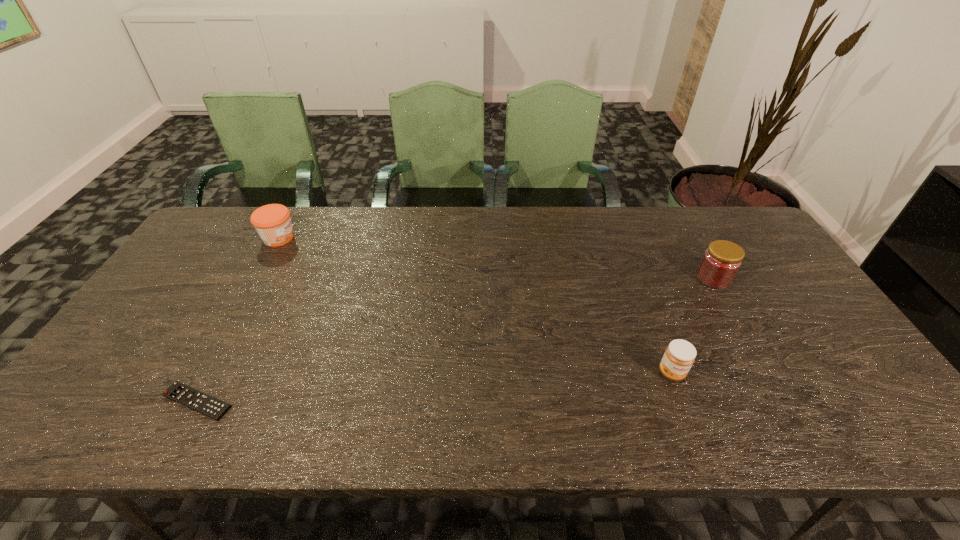
Locate an element on the screen. Image resolution: width=960 pixels, height=540 pixels. free space that satisfies the following two spatial constraints: 1. on the front label of the remote control; 2. on the left side of the farthest jam is located at coordinates (190, 401).

Where is `vacant space that satisfies the following two spatial constraints: 1. on the front label of the shortest object; 2. on the left side of the farthest jam`? vacant space that satisfies the following two spatial constraints: 1. on the front label of the shortest object; 2. on the left side of the farthest jam is located at coordinates (190, 401).